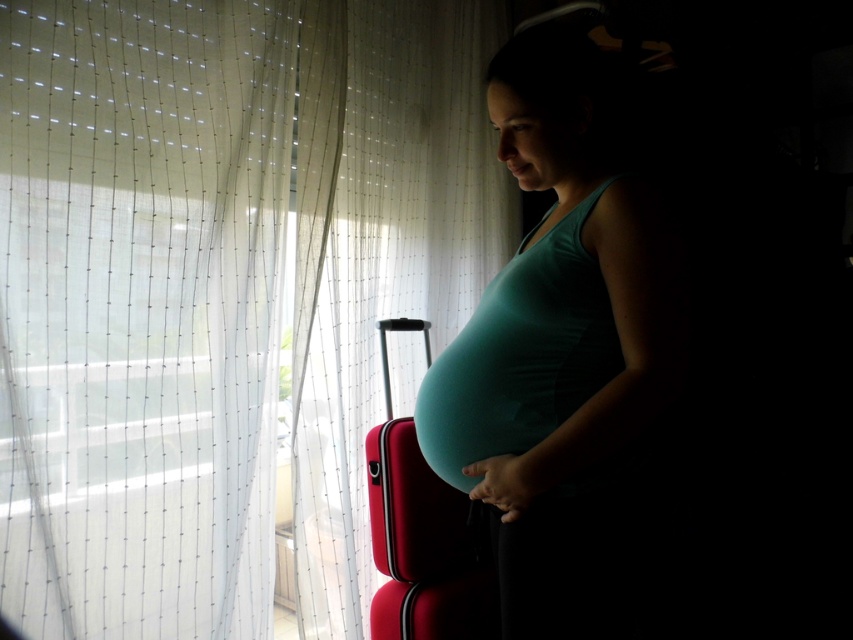
Based on the photo, you are a photographer positioned at the camera. You want to capture a closeup shot of the matte teal tank top at center. Based on the scene description, what is the minimum distance you need to move forward to ensure the subject fills the frame adequately?

The minimum distance you need to move forward is 38.92 inches to ensure the matte teal tank top at center fills the frame adequately.

The pregnant woman is standing near the window and the matte red suitcase at center is in front of her. How far apart are they?

They are 1.32 meters apart.

You are a delivery person entering the room and need to place a package on the floor near the white sheer curtain at left and the matte red suitcase at center. Which object should you move to access the space behind it?

You should move the matte red suitcase at center because the white sheer curtain at left is in front of it, meaning the suitcase is behind the curtain and the space behind can be accessed by moving the suitcase.